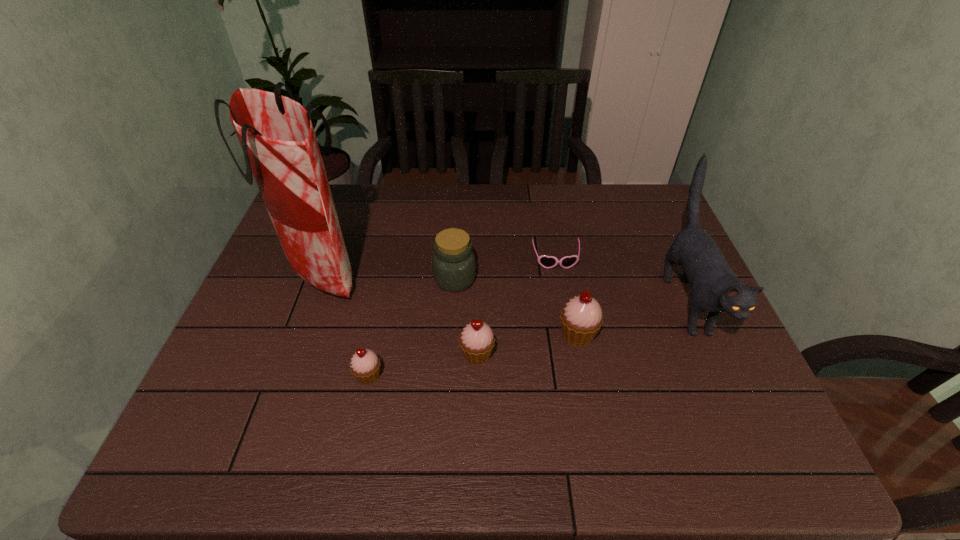
Where is `free space between the jar and the rightmost cupcake`? free space between the jar and the rightmost cupcake is located at coordinates (516, 307).

The height and width of the screenshot is (540, 960). I want to click on free space between the jar and the leftmost cupcake, so click(x=412, y=327).

Locate an element on the screen. The height and width of the screenshot is (540, 960). empty location between the cat and the sunglasses is located at coordinates (621, 281).

Find the location of `free spot between the jar and the second cupcake from left to right`. free spot between the jar and the second cupcake from left to right is located at coordinates (466, 317).

The width and height of the screenshot is (960, 540). I want to click on object that is the sixth closest one to the shortest cupcake, so click(716, 289).

Where is `the fifth closest object to the cat`? the fifth closest object to the cat is located at coordinates (365, 365).

Identify the location of cupcake that is the closest one to the rightmost cupcake. (476, 340).

Where is `the second closest cupcake to the rightmost cupcake`? This screenshot has height=540, width=960. the second closest cupcake to the rightmost cupcake is located at coordinates (365, 365).

Locate an element on the screen. The height and width of the screenshot is (540, 960). vacant position in the image that satisfies the following two spatial constraints: 1. on the back side of the sixth tallest object; 2. on the right side of the tallest cupcake is located at coordinates (377, 335).